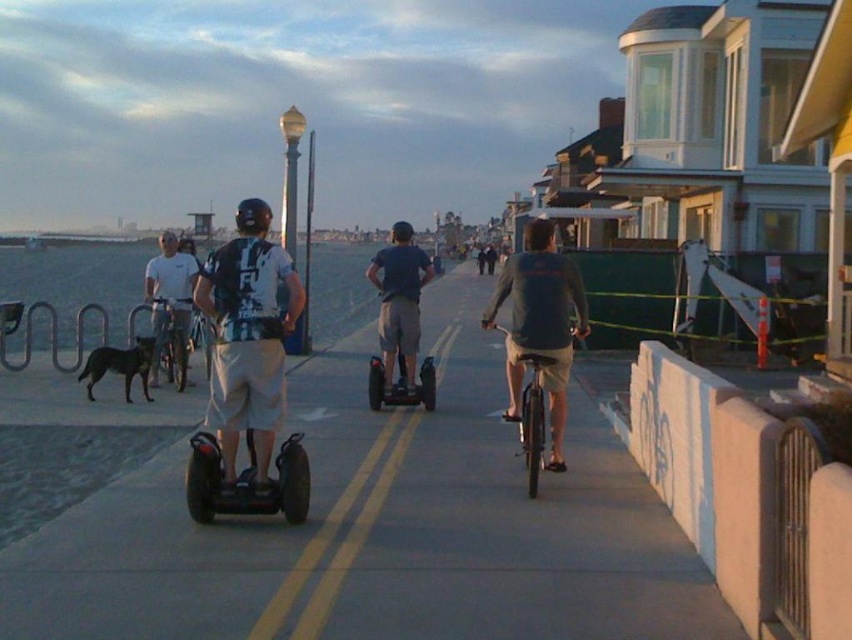
Between point (254, 291) and point (272, 497), which one is positioned in front?

Positioned in front is point (272, 497).

Who is shorter, matte black shirt at center or black rubber segway at center?

Standing shorter between the two is black rubber segway at center.

In order to click on matte black shirt at center in this screenshot , I will do click(248, 336).

Image resolution: width=852 pixels, height=640 pixels. I want to click on matte black shirt at center, so click(248, 336).

Can you confirm if smooth concrete sidewalk at center is positioned to the left of black rubber segway at center?

Yes, smooth concrete sidewalk at center is to the left of black rubber segway at center.

Who is taller, smooth concrete sidewalk at center or black rubber segway at center?

Standing taller between the two is smooth concrete sidewalk at center.

Between point (476, 497) and point (213, 492), which one is positioned behind?

The point (476, 497) is more distant.

This screenshot has width=852, height=640. Find the location of `smooth concrete sidewalk at center`. smooth concrete sidewalk at center is located at coordinates (380, 528).

Between metallic silver bicycle at left and black fur dog at lower left, which one has more height?

Standing taller between the two is metallic silver bicycle at left.

How far apart are metallic silver bicycle at left and black fur dog at lower left?

metallic silver bicycle at left and black fur dog at lower left are 17.11 inches apart.

Measure the distance between point (163, 298) and camera.

Point (163, 298) and camera are 43.53 feet apart from each other.

Where is `metallic silver bicycle at left`? metallic silver bicycle at left is located at coordinates (170, 336).